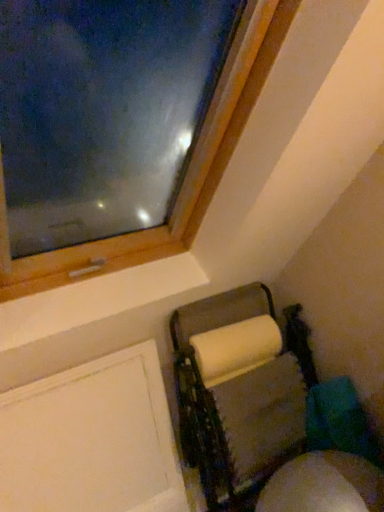
Question: Is white matte screen door at lower left with white cardboard paper towel holder at lower right?

Choices:
 (A) no
 (B) yes

Answer: (A)

Question: Can you confirm if white matte screen door at lower left is shorter than white cardboard paper towel holder at lower right?

Choices:
 (A) no
 (B) yes

Answer: (B)

Question: Is white matte screen door at lower left outside white cardboard paper towel holder at lower right?

Choices:
 (A) no
 (B) yes

Answer: (B)

Question: Is white matte screen door at lower left oriented away from white cardboard paper towel holder at lower right?

Choices:
 (A) no
 (B) yes

Answer: (A)

Question: Is white cardboard paper towel holder at lower right inside white matte screen door at lower left?

Choices:
 (A) yes
 (B) no

Answer: (B)

Question: From a real-world perspective, does white matte screen door at lower left sit lower than white cardboard paper towel holder at lower right?

Choices:
 (A) no
 (B) yes

Answer: (A)

Question: From the image's perspective, is white cardboard paper towel holder at lower right beneath white matte screen door at lower left?

Choices:
 (A) yes
 (B) no

Answer: (B)

Question: Does white cardboard paper towel holder at lower right have a greater width compared to white matte screen door at lower left?

Choices:
 (A) yes
 (B) no

Answer: (A)

Question: Is white cardboard paper towel holder at lower right positioned far away from white matte screen door at lower left?

Choices:
 (A) no
 (B) yes

Answer: (A)

Question: Are white cardboard paper towel holder at lower right and white matte screen door at lower left beside each other?

Choices:
 (A) yes
 (B) no

Answer: (B)

Question: Can you confirm if white cardboard paper towel holder at lower right is positioned to the left of white matte screen door at lower left?

Choices:
 (A) no
 (B) yes

Answer: (A)

Question: Can you confirm if white cardboard paper towel holder at lower right is smaller than white matte screen door at lower left?

Choices:
 (A) yes
 (B) no

Answer: (B)

Question: Considering the positions of white cardboard paper towel holder at lower right and white matte screen door at lower left in the image, is white cardboard paper towel holder at lower right bigger or smaller than white matte screen door at lower left?

Choices:
 (A) small
 (B) big

Answer: (B)